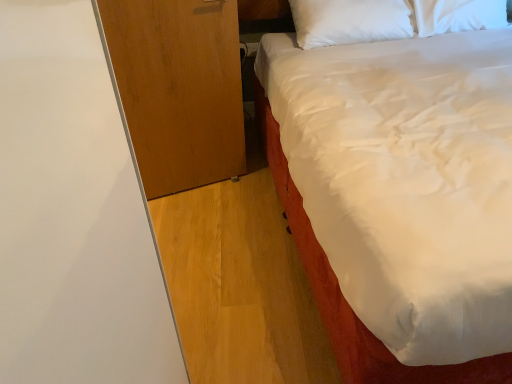
The width and height of the screenshot is (512, 384). I want to click on wooden dresser at left, so click(x=179, y=89).

The image size is (512, 384). What do you see at coordinates (179, 89) in the screenshot?
I see `wooden dresser at left` at bounding box center [179, 89].

Image resolution: width=512 pixels, height=384 pixels. What do you see at coordinates (346, 301) in the screenshot?
I see `white satin bed at upper right` at bounding box center [346, 301].

I want to click on white satin bed at upper right, so click(x=346, y=301).

Locate an element on the screen. wooden dresser at left is located at coordinates (179, 89).

Is wooden dresser at left to the right of white satin bed at upper right from the viewer's perspective?

Incorrect, wooden dresser at left is not on the right side of white satin bed at upper right.

Is wooden dresser at left in front of or behind white satin bed at upper right in the image?

wooden dresser at left is positioned farther from the viewer than white satin bed at upper right.

Which point is more forward, (150, 16) or (263, 133)?

The point (150, 16) is closer.

From the picture: From the image's perspective, which one is positioned higher, wooden dresser at left or white satin bed at upper right?

white satin bed at upper right is shown above in the image.

From a real-world perspective, who is located higher, wooden dresser at left or white satin bed at upper right?

white satin bed at upper right, from a real-world perspective.

Considering the sizes of objects wooden dresser at left and white satin bed at upper right in the image provided, who is wider, wooden dresser at left or white satin bed at upper right?

white satin bed at upper right is wider.

Between wooden dresser at left and white satin bed at upper right, which one has more height?

With more height is white satin bed at upper right.

Between wooden dresser at left and white satin bed at upper right, which one has smaller size?

With smaller size is wooden dresser at left.

Choose the correct answer: Is wooden dresser at left inside white satin bed at upper right or outside it?

wooden dresser at left is located beyond the bounds of white satin bed at upper right.

Is wooden dresser at left next to white satin bed at upper right?

No, wooden dresser at left is not touching white satin bed at upper right.

Is wooden dresser at left facing towards white satin bed at upper right?

No, wooden dresser at left is not aimed at white satin bed at upper right.

How many degrees apart are the facing directions of wooden dresser at left and white satin bed at upper right?

The angle between the facing direction of wooden dresser at left and the facing direction of white satin bed at upper right is 9.11 degrees.

Measure the distance between wooden dresser at left and white satin bed at upper right.

The distance of wooden dresser at left from white satin bed at upper right is 20.96 inches.

Where is `dresser behind the white satin bed at upper right`? dresser behind the white satin bed at upper right is located at coordinates (x=179, y=89).

Which is more to the left, white satin bed at upper right or wooden dresser at left?

From the viewer's perspective, wooden dresser at left appears more on the left side.

Which object is further away from the camera, white satin bed at upper right or wooden dresser at left?

Positioned behind is wooden dresser at left.

Which is in front, point (270, 116) or point (217, 170)?

The point (270, 116) is closer to the camera.

From the image's perspective, is white satin bed at upper right positioned above or below wooden dresser at left?

Clearly, from the image's perspective, white satin bed at upper right is above wooden dresser at left.

From a real-world perspective, which is physically below, white satin bed at upper right or wooden dresser at left?

wooden dresser at left, from a real-world perspective.

Considering the sizes of white satin bed at upper right and wooden dresser at left in the image, is white satin bed at upper right wider or thinner than wooden dresser at left?

Clearly, white satin bed at upper right has more width compared to wooden dresser at left.

Is white satin bed at upper right taller than wooden dresser at left?

Yes.

Between white satin bed at upper right and wooden dresser at left, which one has smaller size?

wooden dresser at left is smaller.

Would you say white satin bed at upper right is outside wooden dresser at left?

That's correct, white satin bed at upper right is outside of wooden dresser at left.

Is white satin bed at upper right far away from wooden dresser at left?

white satin bed at upper right is near wooden dresser at left, not far away.

Is wooden dresser at left at the back of white satin bed at upper right?

No, white satin bed at upper right is not facing away from wooden dresser at left.

Can you tell me how much white satin bed at upper right and wooden dresser at left differ in facing direction?

9.11 degrees.

How distant is white satin bed at upper right from wooden dresser at left?

white satin bed at upper right is 53.25 centimeters away from wooden dresser at left.

The image size is (512, 384). Find the location of `dresser on the left of white satin bed at upper right`. dresser on the left of white satin bed at upper right is located at coordinates (179, 89).

Image resolution: width=512 pixels, height=384 pixels. Identify the location of bed in front of the wooden dresser at left. (346, 301).

In order to click on dresser on the left side of white satin bed at upper right in this screenshot , I will do `click(179, 89)`.